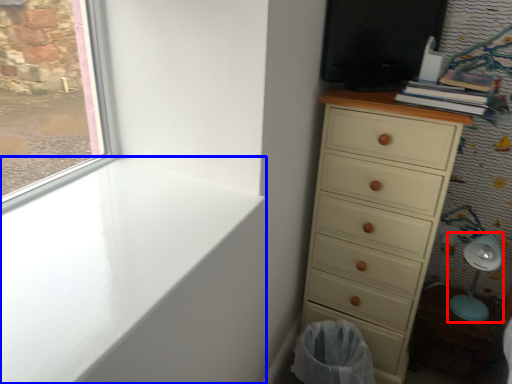
Question: Which of the following is the farthest to the observer, swivel chair (highlighted by a red box) or window sill (highlighted by a blue box)?

Choices:
 (A) swivel chair
 (B) window sill

Answer: (A)